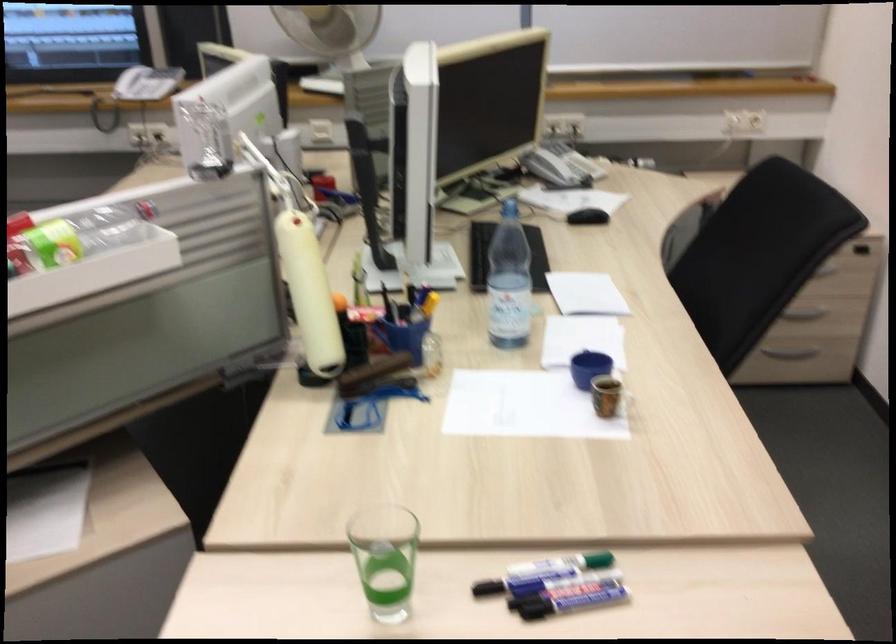
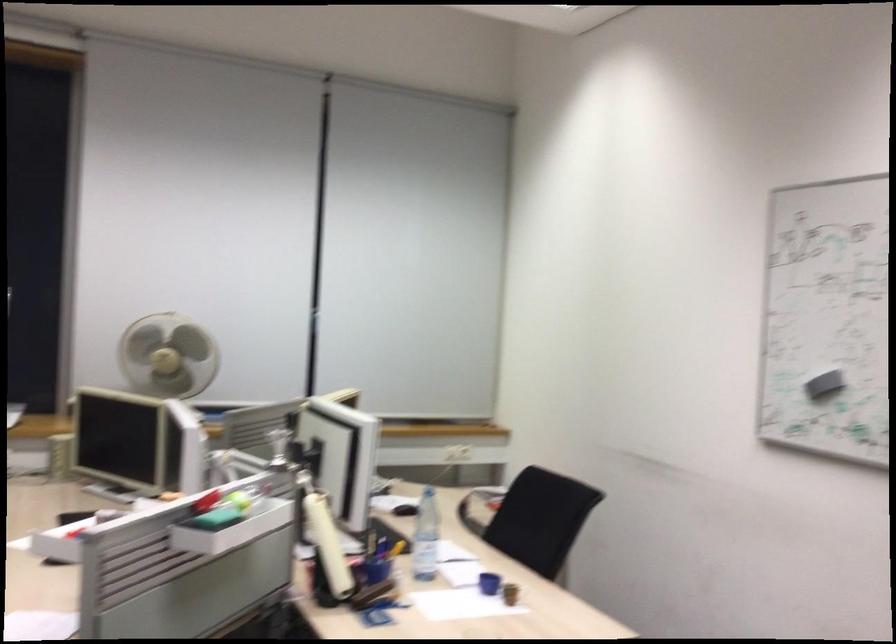
Find the pixel in the second image that matches (x=519, y=287) in the first image.

(426, 536)